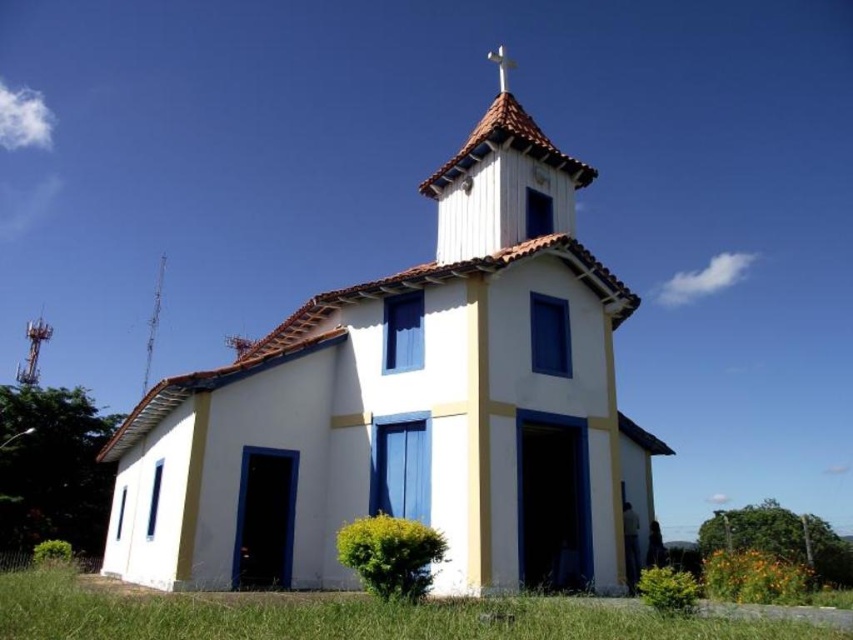
Question: Which point is closer to the camera?

Choices:
 (A) (619, 618)
 (B) (515, 131)

Answer: (A)

Question: Which point is farther to the camera?

Choices:
 (A) green grass at lower center
 (B) white painted wood church at center

Answer: (B)

Question: Observing the image, what is the correct spatial positioning of white painted wood church at center in reference to smooth white spire at upper center?

Choices:
 (A) below
 (B) above

Answer: (B)

Question: Does white painted wood church at center have a smaller size compared to green grass at lower center?

Choices:
 (A) yes
 (B) no

Answer: (B)

Question: Can you confirm if green grass at lower center is wider than smooth white spire at upper center?

Choices:
 (A) no
 (B) yes

Answer: (B)

Question: Which of the following is the farthest from the observer?

Choices:
 (A) (270, 433)
 (B) (149, 314)
 (C) (706, 634)

Answer: (B)